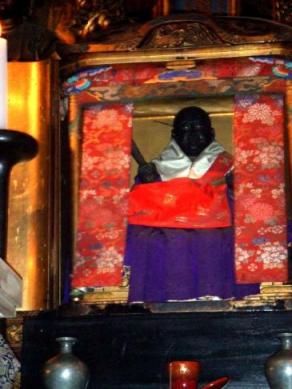
You are a GUI agent. You are given a task and a screenshot of the screen. Output one action in this format:
    pyautogui.click(x=<x>, y=<y>)
    Task: Click on the shelf
    The image size is (292, 389).
    Given the screenshot: What is the action you would take?
    coord(144,332)